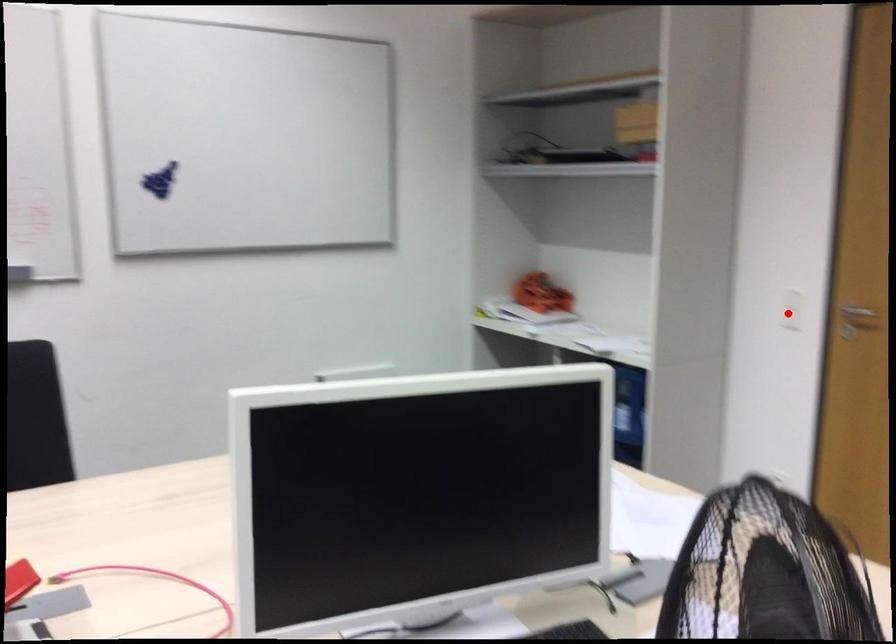
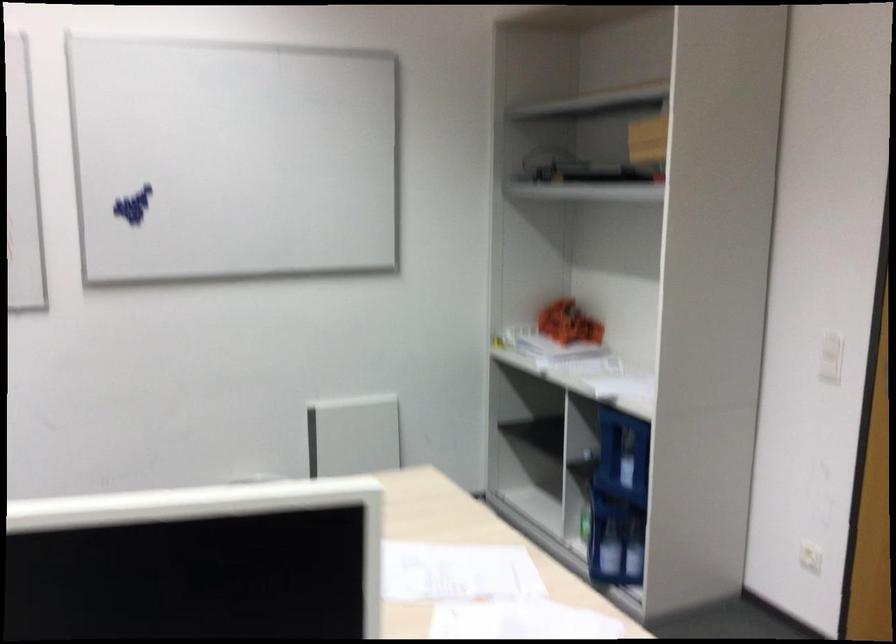
Question: A red point is marked in image1. In image2, is the corresponding 3D point closer to the camera or farther? Reply with the corresponding letter.

Choices:
 (A) The corresponding 3D point is closer.
 (B) The corresponding 3D point is farther.

Answer: (A)